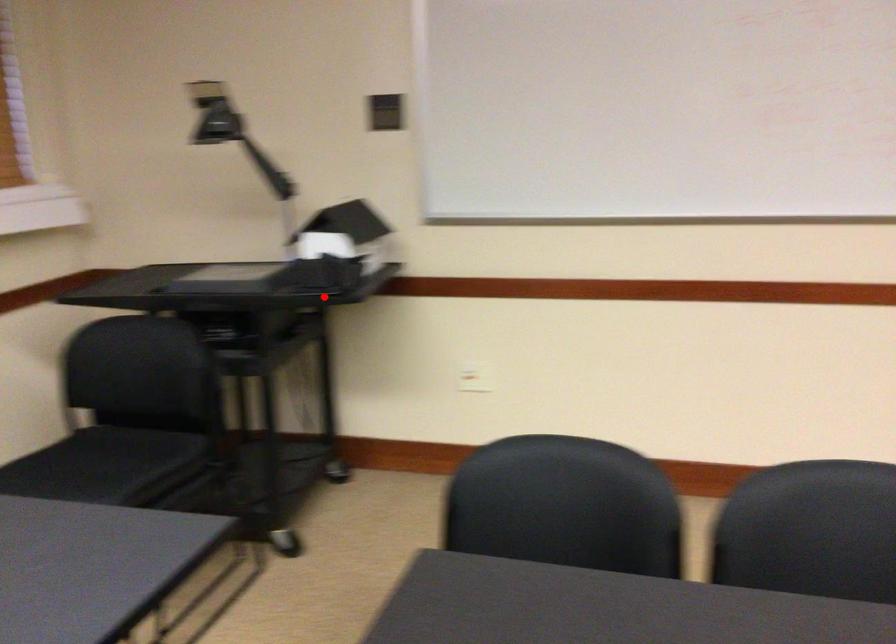
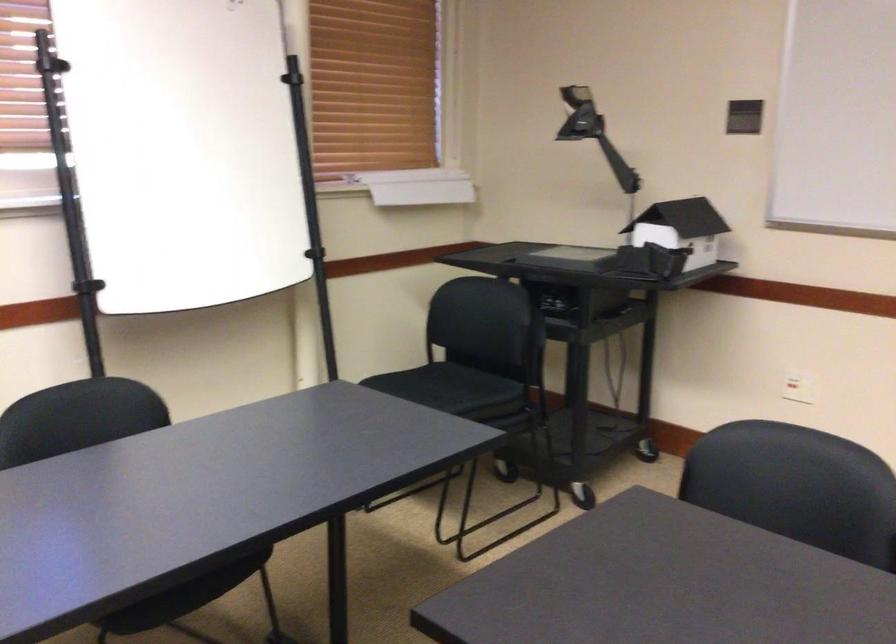
Find the pixel in the second image that matches the highlighted location in the first image.

(635, 279)